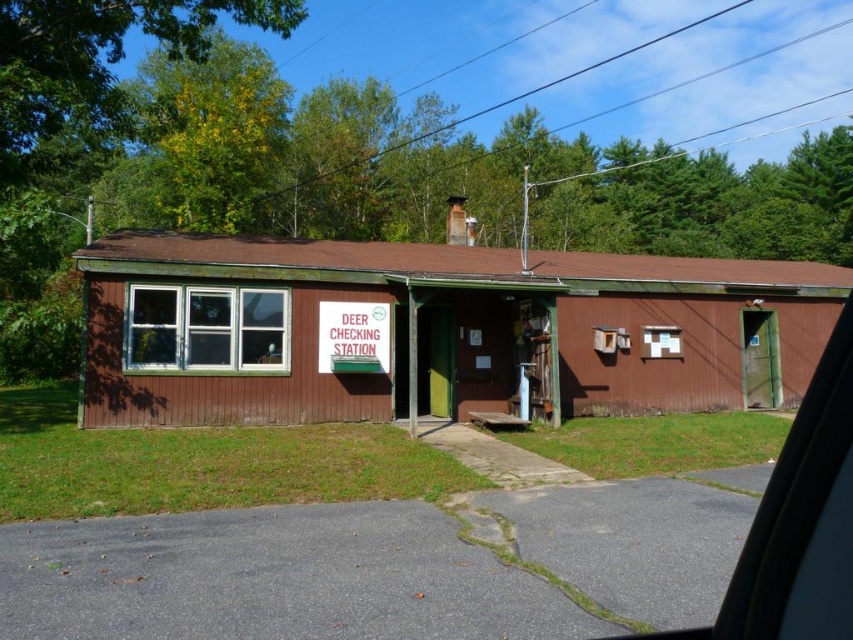
Question: Considering the relative positions of brown woodshed at center and white plastic sign at center in the image provided, where is brown woodshed at center located with respect to white plastic sign at center?

Choices:
 (A) left
 (B) right

Answer: (B)

Question: Which of the following is the farthest from the observer?

Choices:
 (A) white plastic sign at center
 (B) brown woodshed at center

Answer: (A)

Question: Is brown woodshed at center in front of white plastic sign at center?

Choices:
 (A) no
 (B) yes

Answer: (B)

Question: Which object appears farthest from the camera in this image?

Choices:
 (A) brown woodshed at center
 (B) white plastic sign at center

Answer: (B)

Question: Considering the relative positions of brown woodshed at center and white plastic sign at center in the image provided, where is brown woodshed at center located with respect to white plastic sign at center?

Choices:
 (A) below
 (B) above

Answer: (B)